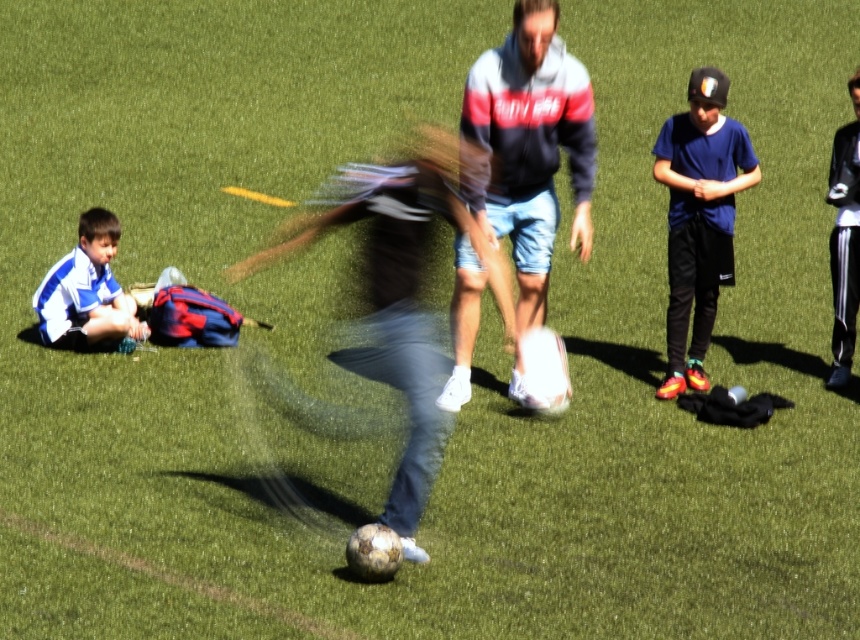
Question: Is dark gray hoodie at center further to camera compared to blue jersey at right?

Choices:
 (A) yes
 (B) no

Answer: (B)

Question: Considering the real-world distances, which object is farthest from the black leather jacket at right?

Choices:
 (A) striped jersey at lower left
 (B) blue jersey at right
 (C) dark gray hoodie at center

Answer: (A)

Question: Does dark gray hoodie at center appear over blue jersey at right?

Choices:
 (A) no
 (B) yes

Answer: (B)

Question: Which point is closer to the camera?

Choices:
 (A) dark gray hoodie at center
 (B) black leather jacket at right
 (C) striped jersey at lower left

Answer: (A)

Question: Is striped jersey at lower left to the left of black leather jacket at right from the viewer's perspective?

Choices:
 (A) yes
 (B) no

Answer: (A)

Question: Which of these objects is positioned farthest from the striped jersey at lower left?

Choices:
 (A) blue jersey at right
 (B) dark gray hoodie at center
 (C) black leather jacket at right

Answer: (C)